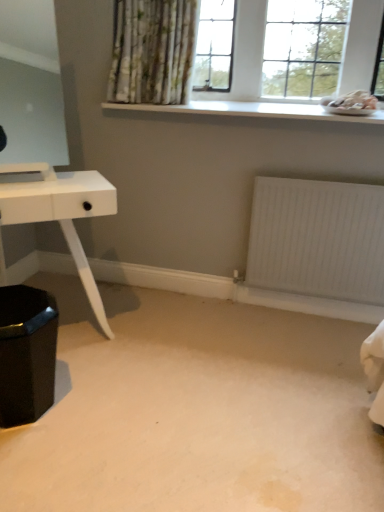
Question: Considering the relative sizes of white wooden window at upper center and white smooth window sill at upper center in the image provided, is white wooden window at upper center bigger than white smooth window sill at upper center?

Choices:
 (A) yes
 (B) no

Answer: (A)

Question: Is white wooden window at upper center positioned far away from white smooth window sill at upper center?

Choices:
 (A) no
 (B) yes

Answer: (A)

Question: Is white wooden window at upper center at the left side of white smooth window sill at upper center?

Choices:
 (A) yes
 (B) no

Answer: (B)

Question: Does white wooden window at upper center have a lesser width compared to white smooth window sill at upper center?

Choices:
 (A) no
 (B) yes

Answer: (B)

Question: From the image's perspective, is white wooden window at upper center above white smooth window sill at upper center?

Choices:
 (A) no
 (B) yes

Answer: (B)

Question: From the image's perspective, is white wooden window at upper center below white smooth window sill at upper center?

Choices:
 (A) yes
 (B) no

Answer: (B)

Question: Can shiny black hexagonal stool at lower left be found inside white glossy table at left?

Choices:
 (A) no
 (B) yes

Answer: (A)

Question: Does white glossy table at left have a greater width compared to shiny black hexagonal stool at lower left?

Choices:
 (A) no
 (B) yes

Answer: (B)

Question: Is white glossy table at left further to the viewer compared to shiny black hexagonal stool at lower left?

Choices:
 (A) yes
 (B) no

Answer: (A)

Question: From a real-world perspective, is white glossy table at left over shiny black hexagonal stool at lower left?

Choices:
 (A) yes
 (B) no

Answer: (A)

Question: Is white glossy table at left touching shiny black hexagonal stool at lower left?

Choices:
 (A) yes
 (B) no

Answer: (B)

Question: Is white glossy table at left not near shiny black hexagonal stool at lower left?

Choices:
 (A) no
 (B) yes

Answer: (A)

Question: From the image's perspective, would you say white textured radiator at lower right is positioned over shiny black hexagonal stool at lower left?

Choices:
 (A) yes
 (B) no

Answer: (A)